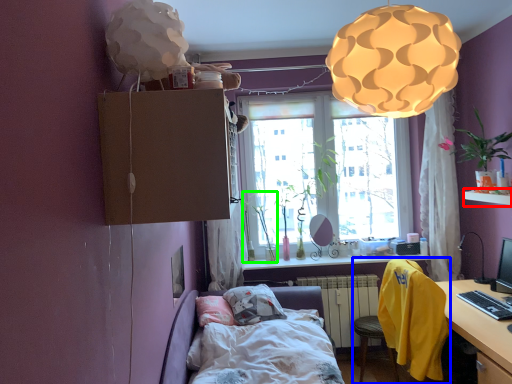
Question: Considering the real-world distances, which object is farthest from window sill (highlighted by a red box)? chair (highlighted by a blue box) or plant (highlighted by a green box)?

Choices:
 (A) chair
 (B) plant

Answer: (B)